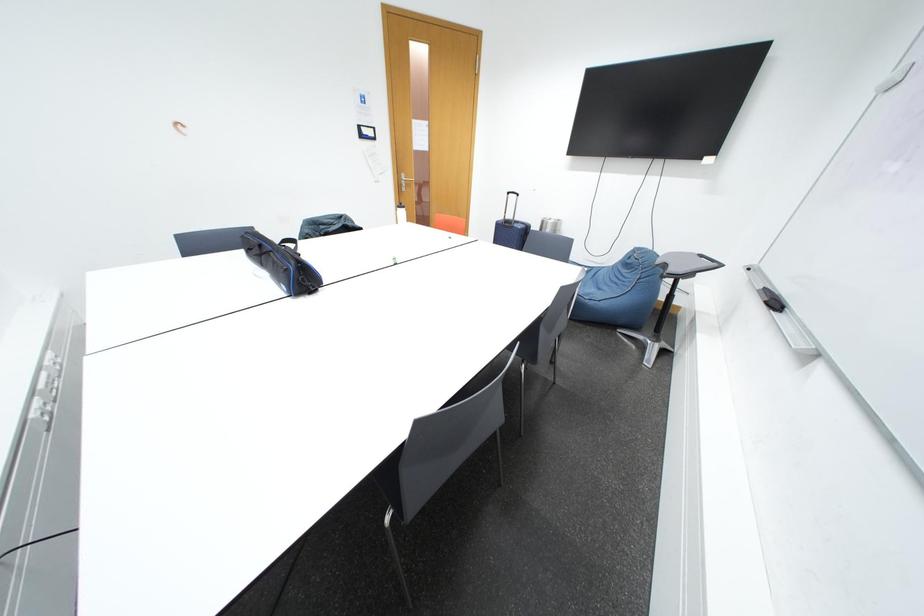
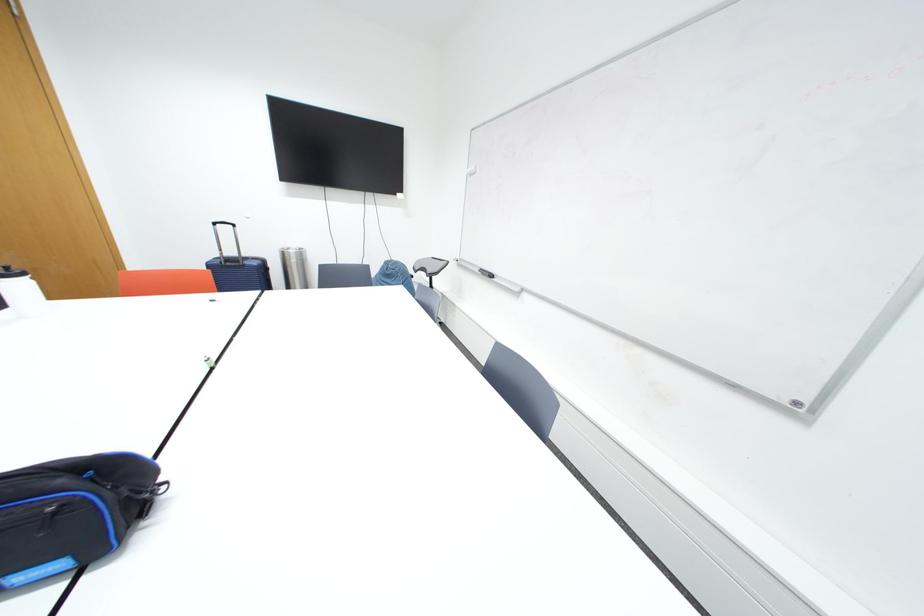
Question: The camera is either moving clockwise (left) or counter-clockwise (right) around the object. The first image is from the beginning of the video and the second image is from the end. Is the camera moving left or right when shooting the video?

Choices:
 (A) Left
 (B) Right

Answer: (A)